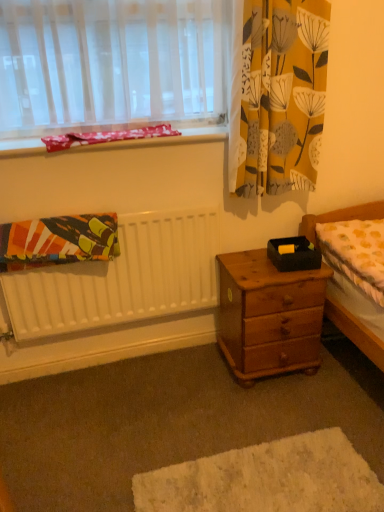
Where is `free space to the left of wooden nightstand at center`? free space to the left of wooden nightstand at center is located at coordinates (189, 379).